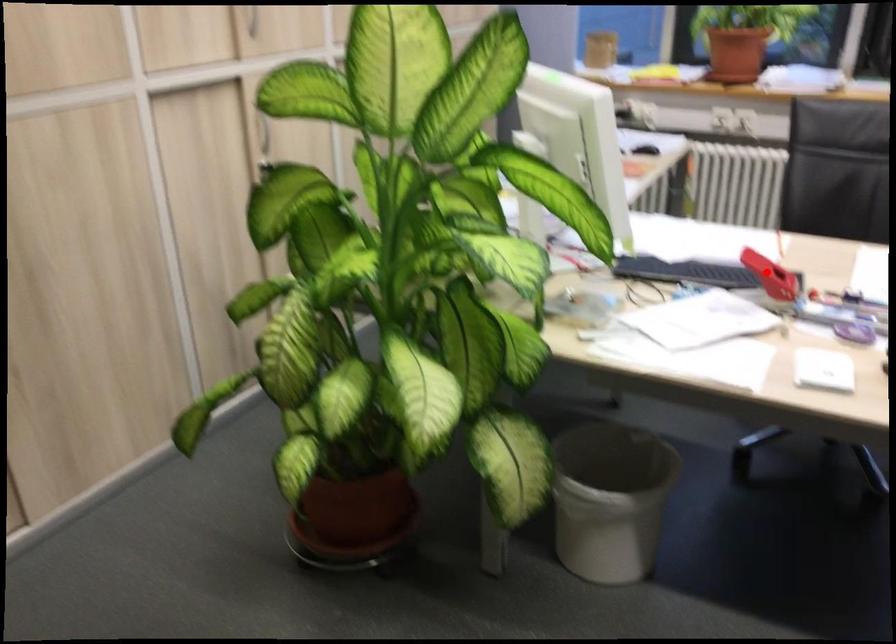
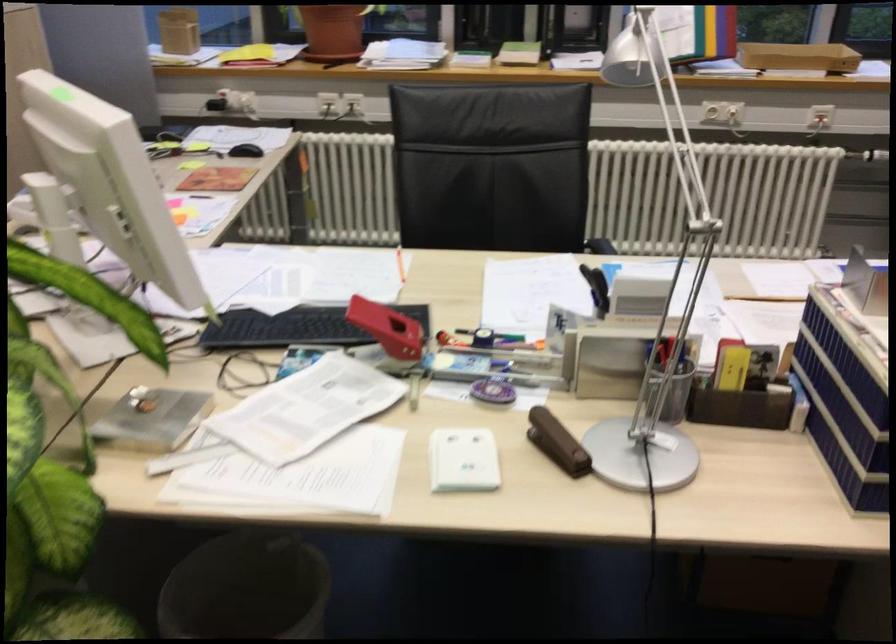
Question: I am providing you with two images of the same scene from different viewpoints. Given a red point in image1, look at the same physical point in image2. Is it:

Choices:
 (A) Closer to the viewpoint
 (B) Farther from the viewpoint

Answer: (A)